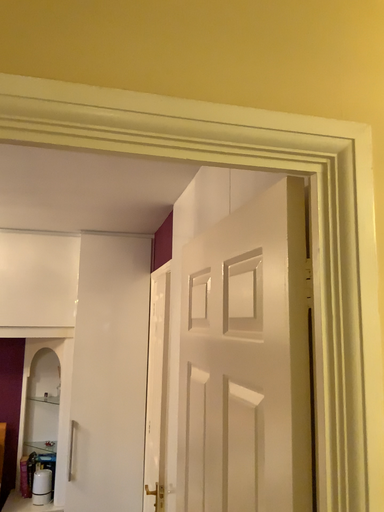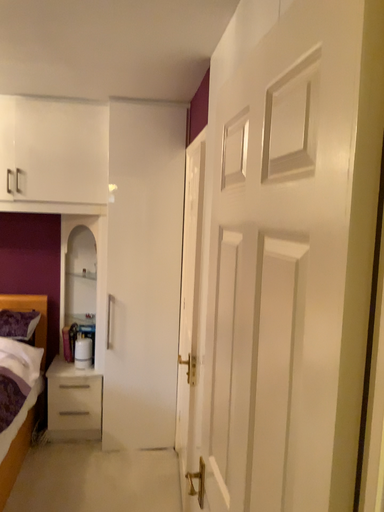
Question: Which way did the camera rotate in the video?

Choices:
 (A) rotated upward
 (B) rotated downward

Answer: (B)